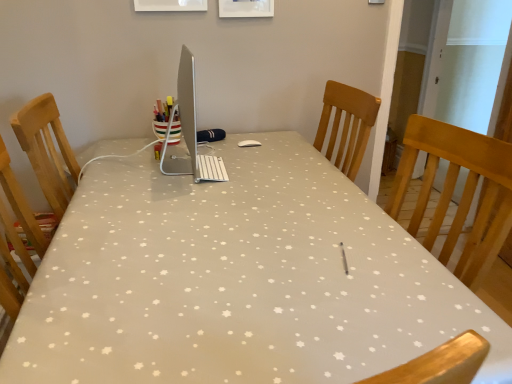
The image size is (512, 384). Describe the element at coordinates (237, 280) in the screenshot. I see `white fabric table at center` at that location.

Measure the distance between point (226, 259) and camera.

The distance of point (226, 259) from camera is 3.54 feet.

I want to click on white fabric table at center, so click(237, 280).

The height and width of the screenshot is (384, 512). What do you see at coordinates (189, 131) in the screenshot?
I see `sleek silver desktop at center` at bounding box center [189, 131].

Measure the distance between point (188,151) and camera.

Point (188,151) is 4.75 feet away from camera.

Where is `sleek silver desktop at center`? The width and height of the screenshot is (512, 384). sleek silver desktop at center is located at coordinates (189, 131).

Locate an element on the screen. Image resolution: width=512 pixels, height=384 pixels. white fabric table at center is located at coordinates (237, 280).

Is white fabric table at center to the right of sleek silver desktop at center from the viewer's perspective?

Yes, white fabric table at center is to the right of sleek silver desktop at center.

Which object is closer to the camera taking this photo, white fabric table at center or sleek silver desktop at center?

Positioned in front is white fabric table at center.

Is point (244, 373) closer to viewer compared to point (187, 137)?

Yes.

From the image's perspective, is white fabric table at center located beneath sleek silver desktop at center?

Correct, white fabric table at center appears lower than sleek silver desktop at center in the image.

From a real-world perspective, which object stands above the other?

sleek silver desktop at center.

Is white fabric table at center wider or thinner than sleek silver desktop at center?

Clearly, white fabric table at center has more width compared to sleek silver desktop at center.

Does white fabric table at center have a greater height compared to sleek silver desktop at center?

Yes, white fabric table at center is taller than sleek silver desktop at center.

Who is bigger, white fabric table at center or sleek silver desktop at center?

white fabric table at center is bigger.

Would you say sleek silver desktop at center is part of white fabric table at center's contents?

No, sleek silver desktop at center is not inside white fabric table at center.

Is there a large distance between white fabric table at center and sleek silver desktop at center?

They are positioned close to each other.

Is white fabric table at center facing away from sleek silver desktop at center?

white fabric table at center does not have its back to sleek silver desktop at center.

Can you tell me how much white fabric table at center and sleek silver desktop at center differ in facing direction?

The angular difference between white fabric table at center and sleek silver desktop at center is 90 degrees.

You are a GUI agent. You are given a task and a screenshot of the screen. Output one action in this format:
    pyautogui.click(x=<x>, y=<y>)
    Task: Click on the desktop computer behind the white fabric table at center
    Image resolution: width=512 pixels, height=384 pixels.
    Given the screenshot: What is the action you would take?
    pyautogui.click(x=189, y=131)

Which object is positioned more to the right, sleek silver desktop at center or white fabric table at center?

Positioned to the right is white fabric table at center.

Which object is closer to the camera, sleek silver desktop at center or white fabric table at center?

white fabric table at center.

Which is in front, point (183, 93) or point (448, 322)?

Positioned in front is point (448, 322).

Looking at this image, from the image's perspective, does sleek silver desktop at center appear higher than white fabric table at center?

Yes, from the image's perspective, sleek silver desktop at center is above white fabric table at center.

From a real-world perspective, is sleek silver desktop at center physically above white fabric table at center?

Yes, from a real-world perspective, sleek silver desktop at center is over white fabric table at center

In terms of width, does sleek silver desktop at center look wider or thinner when compared to white fabric table at center?

Clearly, sleek silver desktop at center has less width compared to white fabric table at center.

Which of these two, sleek silver desktop at center or white fabric table at center, stands taller?

white fabric table at center is taller.

Considering the relative sizes of sleek silver desktop at center and white fabric table at center in the image provided, is sleek silver desktop at center smaller than white fabric table at center?

Indeed, sleek silver desktop at center has a smaller size compared to white fabric table at center.

Which is correct: sleek silver desktop at center is inside white fabric table at center, or outside of it?

sleek silver desktop at center is spatially situated outside white fabric table at center.

Is sleek silver desktop at center next to white fabric table at center and touching it?

sleek silver desktop at center and white fabric table at center are clearly separated.

From the picture: Is sleek silver desktop at center facing towards white fabric table at center?

No, sleek silver desktop at center does not turn towards white fabric table at center.

How different are the orientations of sleek silver desktop at center and white fabric table at center in degrees?

The angular difference between sleek silver desktop at center and white fabric table at center is 90 degrees.

Locate an element on the screen. This screenshot has height=384, width=512. table in front of the sleek silver desktop at center is located at coordinates (237, 280).

I want to click on desktop computer located on the left of white fabric table at center, so click(189, 131).

Find the location of a particular element. table on the right side of sleek silver desktop at center is located at coordinates (237, 280).